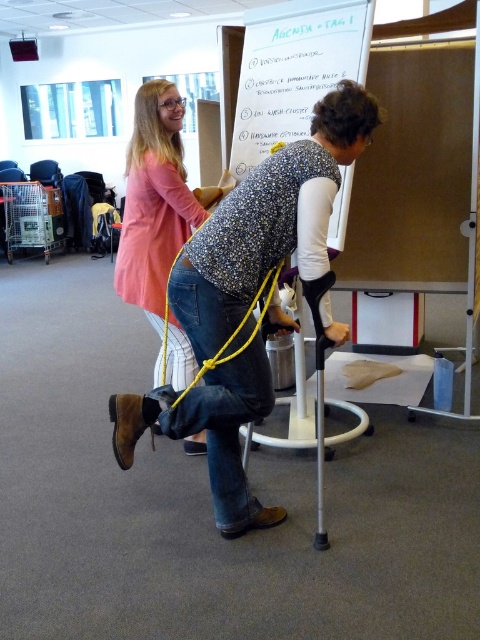
You are an observer standing at the back of the room looking towards the front. You see the denim jeans at center and the matte pink sweater at upper left. Which one is closer to you?

The denim jeans at center is in front of the matte pink sweater at upper left, so the denim jeans at center is closer to you.

You are an observer in the workshop. You see the denim jeans at center and the yellow string at center. Which object is nearer to you?

The denim jeans at center is closer to the viewer than the yellow string at center.